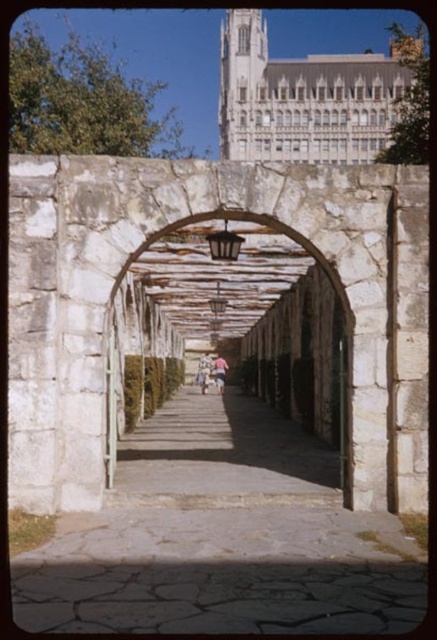
Question: Can you confirm if paved stone path at center is smaller than wooden lattice archway at center?

Choices:
 (A) no
 (B) yes

Answer: (B)

Question: Is paved stone path at center thinner than wooden lattice archway at center?

Choices:
 (A) no
 (B) yes

Answer: (B)

Question: Which point is closer to the camera?

Choices:
 (A) (236, 67)
 (B) (190, 472)
 (C) (205, 388)
 (D) (166, 324)

Answer: (B)

Question: Which of the following is the closest to the observer?

Choices:
 (A) white wooden pergola at upper center
 (B) paved stone path at center

Answer: (B)

Question: Can you confirm if white wooden pergola at upper center is positioned below light blue denim shorts at center?

Choices:
 (A) no
 (B) yes

Answer: (A)

Question: Among these points, which one is farthest from the camera?

Choices:
 (A) (142, 528)
 (B) (312, 356)

Answer: (B)